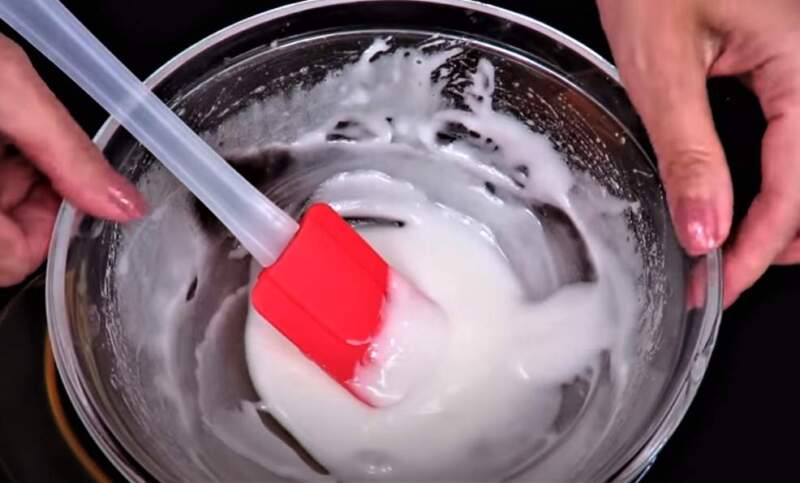
What are the coordinates of `black table` in the screenshot? It's located at (765, 411).